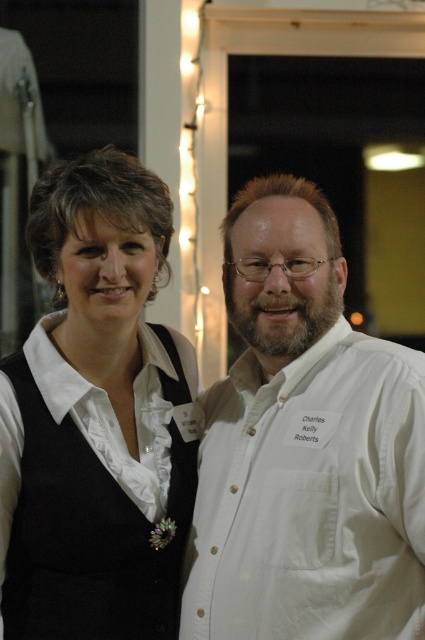
Can you confirm if white cotton shirt at center is bigger than white matte vest at center?

Yes.

Where is `white cotton shirt at center`? The height and width of the screenshot is (640, 425). white cotton shirt at center is located at coordinates (305, 445).